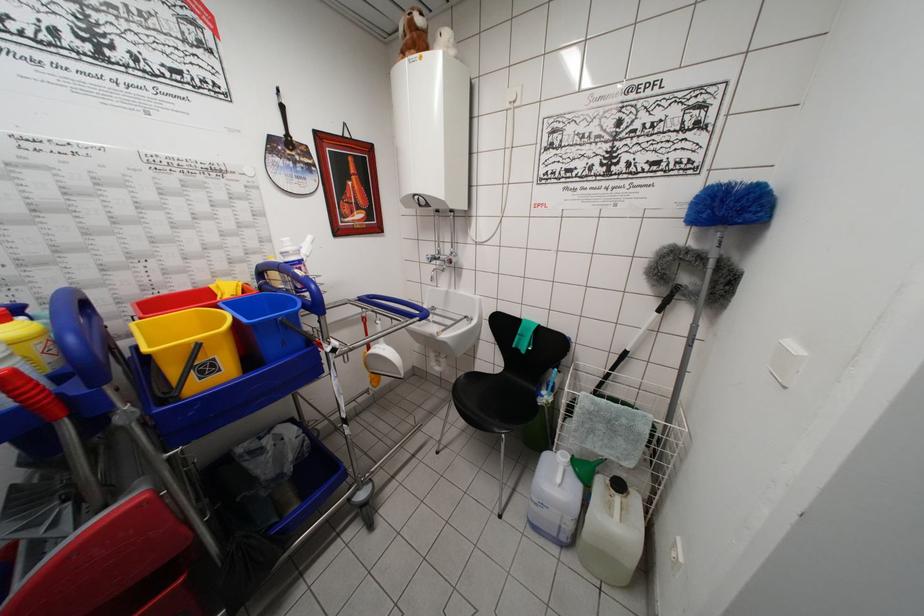
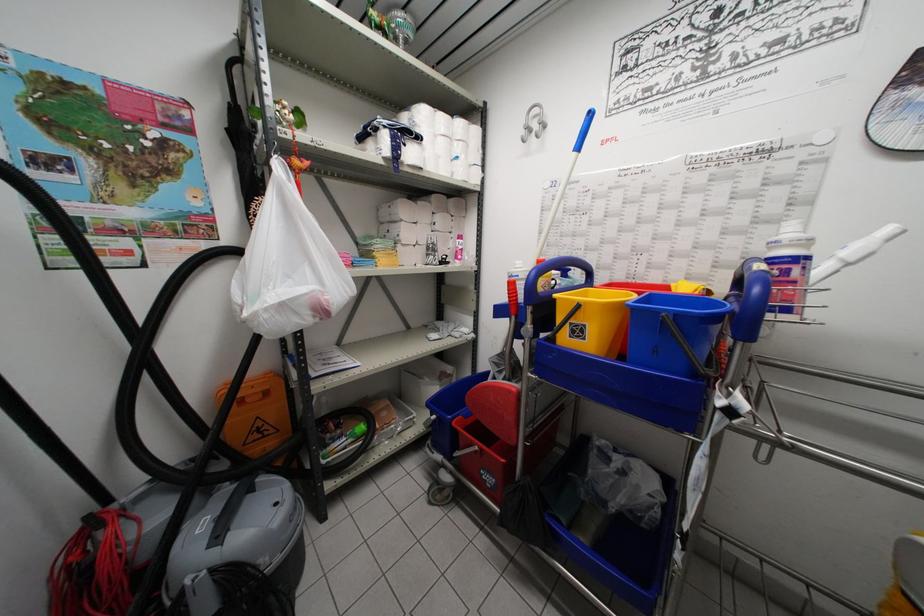
Question: The camera is either moving clockwise (left) or counter-clockwise (right) around the object. The first image is from the beginning of the video and the second image is from the end. Is the camera moving left or right when shooting the video?

Choices:
 (A) Left
 (B) Right

Answer: (B)